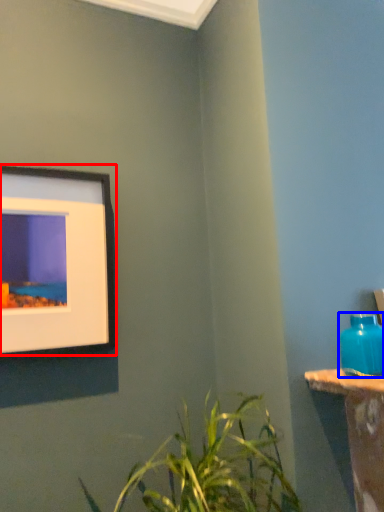
Question: Which object appears closest to the camera in this image, picture frame (highlighted by a red box) or bottle (highlighted by a blue box)?

Choices:
 (A) picture frame
 (B) bottle

Answer: (B)